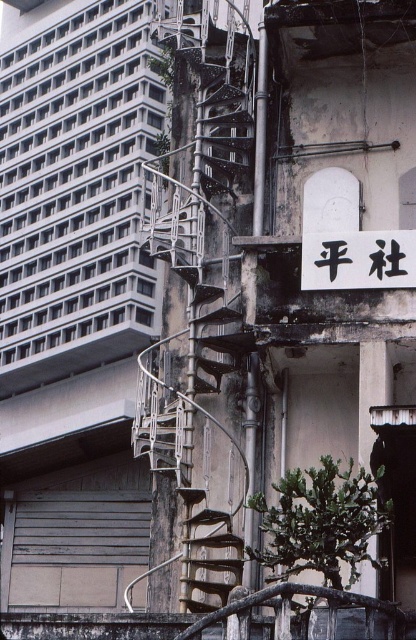
Question: Is rusty metal fire escape at center thinner than black matte sign at upper center?

Choices:
 (A) yes
 (B) no

Answer: (B)

Question: Is rusty metal fire escape at center positioned behind black matte sign at upper center?

Choices:
 (A) no
 (B) yes

Answer: (B)

Question: Is rusty metal fire escape at center to the right of black matte sign at upper center from the viewer's perspective?

Choices:
 (A) yes
 (B) no

Answer: (B)

Question: Which point is closer to the camera?

Choices:
 (A) rusty metal fire escape at center
 (B) black matte sign at upper center

Answer: (B)

Question: Which point is farther to the camera?

Choices:
 (A) (356, 276)
 (B) (217, 88)

Answer: (B)

Question: Among these points, which one is farthest from the camera?

Choices:
 (A) (302, 285)
 (B) (212, 115)

Answer: (B)